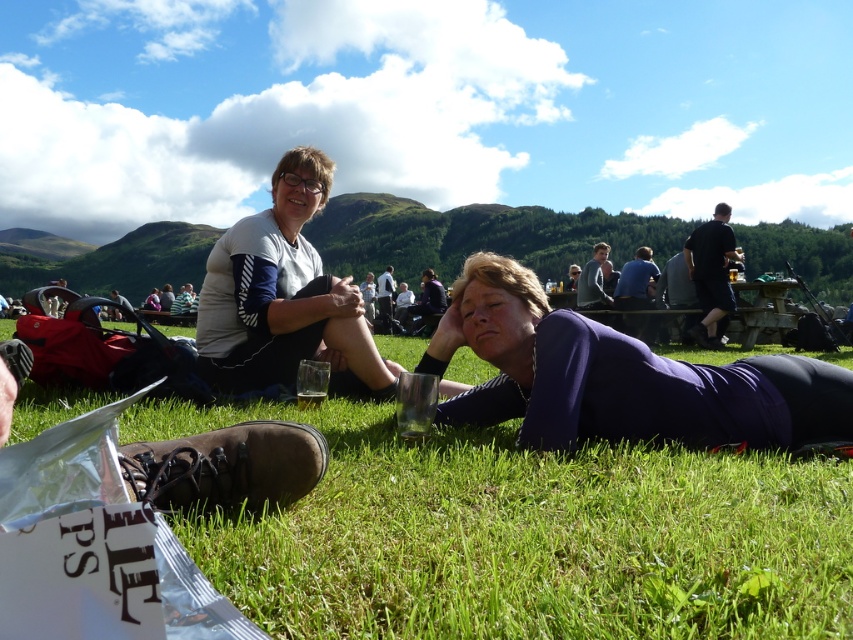
Which is above, white fabric shirt at upper left or matte black backpack at left?

matte black backpack at left is above.

Between point (254, 355) and point (115, 316), which one is positioned in front?

Positioned in front is point (254, 355).

You are a GUI agent. You are given a task and a screenshot of the screen. Output one action in this format:
    pyautogui.click(x=<x>, y=<y>)
    Task: Click on the white fabric shirt at upper left
    
    Given the screenshot: What is the action you would take?
    pos(283,298)

Does black smooth shirt at upper right have a larger size compared to gray sweater at center?

No, black smooth shirt at upper right is not bigger than gray sweater at center.

Can you confirm if black smooth shirt at upper right is shorter than gray sweater at center?

In fact, black smooth shirt at upper right may be taller than gray sweater at center.

In the scene shown: Who is more distant from viewer, (712, 252) or (605, 256)?

The point (605, 256) is more distant.

The height and width of the screenshot is (640, 853). In order to click on black smooth shirt at upper right in this screenshot , I will do `click(711, 273)`.

Is white fabric shirt at upper left below black smooth shirt at upper right?

Indeed, white fabric shirt at upper left is positioned under black smooth shirt at upper right.

Between white fabric shirt at upper left and black smooth shirt at upper right, which one is positioned higher?

black smooth shirt at upper right

Which is behind, point (267, 288) or point (704, 344)?

The point (704, 344) is behind.

In order to click on white fabric shirt at upper left in this screenshot , I will do `click(283, 298)`.